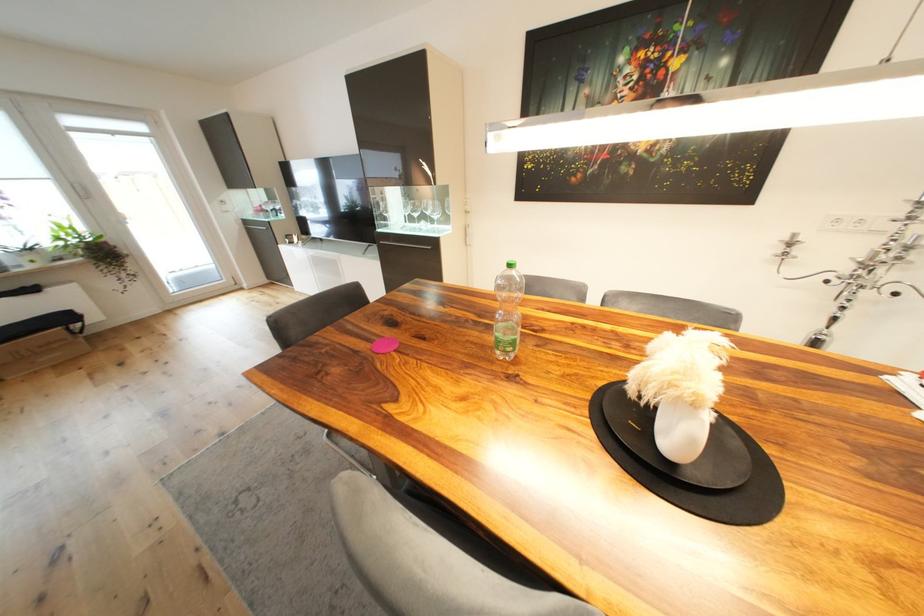
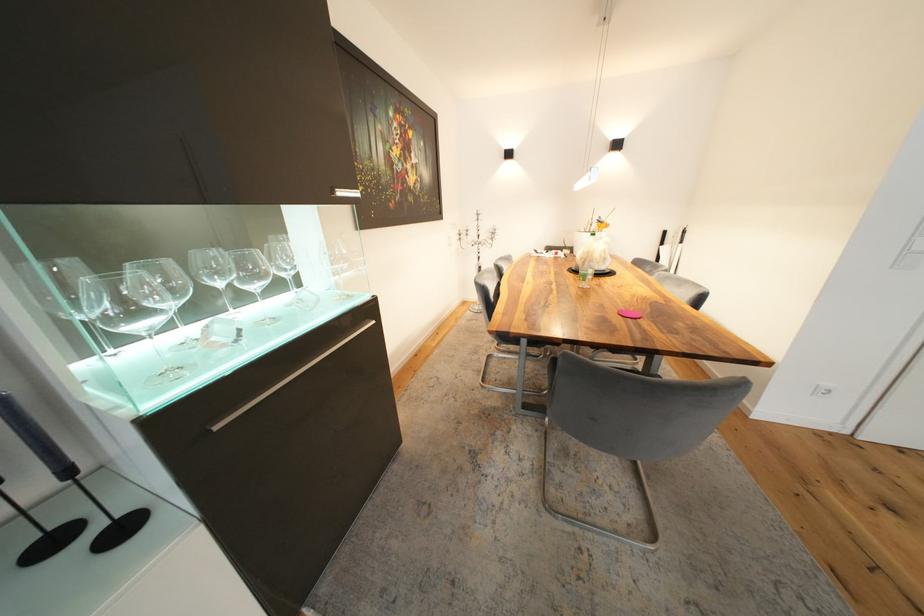
Where in the second image is the point corresponding to (x=797, y=246) from the first image?

(467, 236)